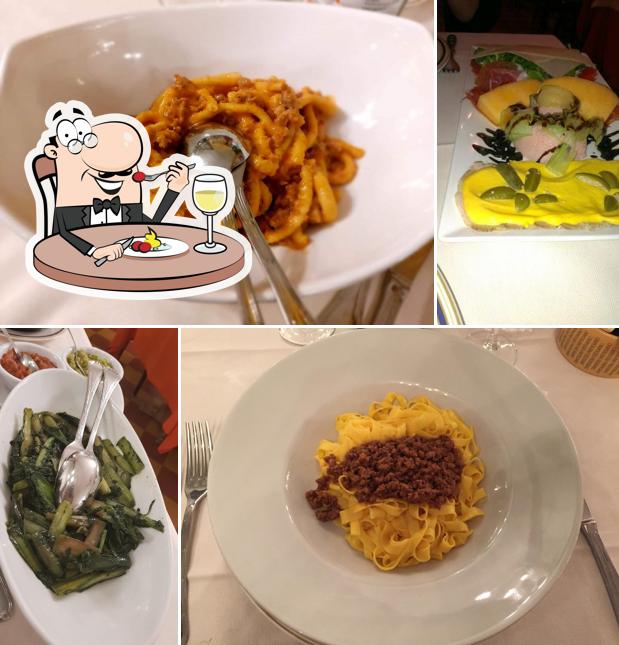
This screenshot has height=645, width=619. I want to click on utensil, so point(82,467), point(72,439), point(200,495), point(124,240), point(150,169), point(280,282), point(243,298), point(451,55).